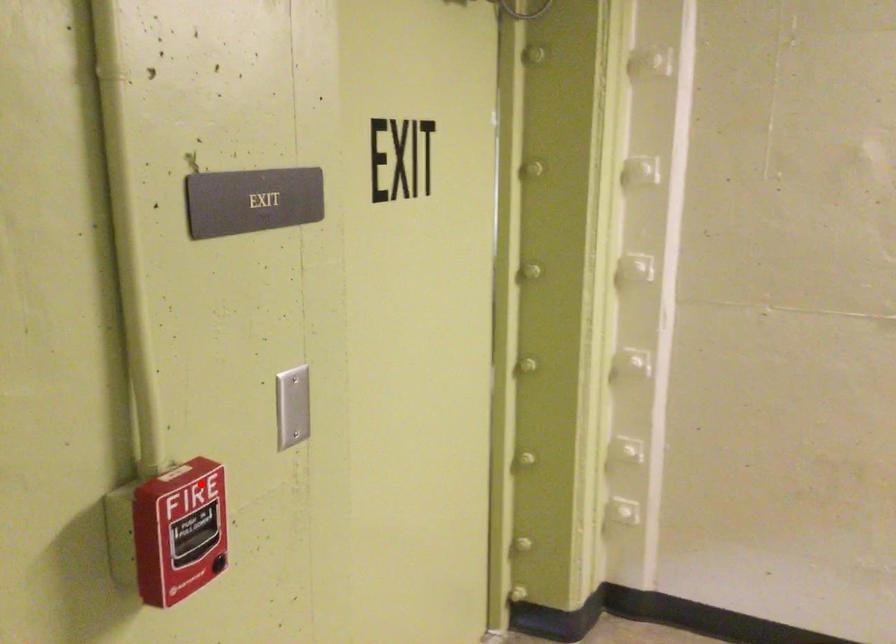
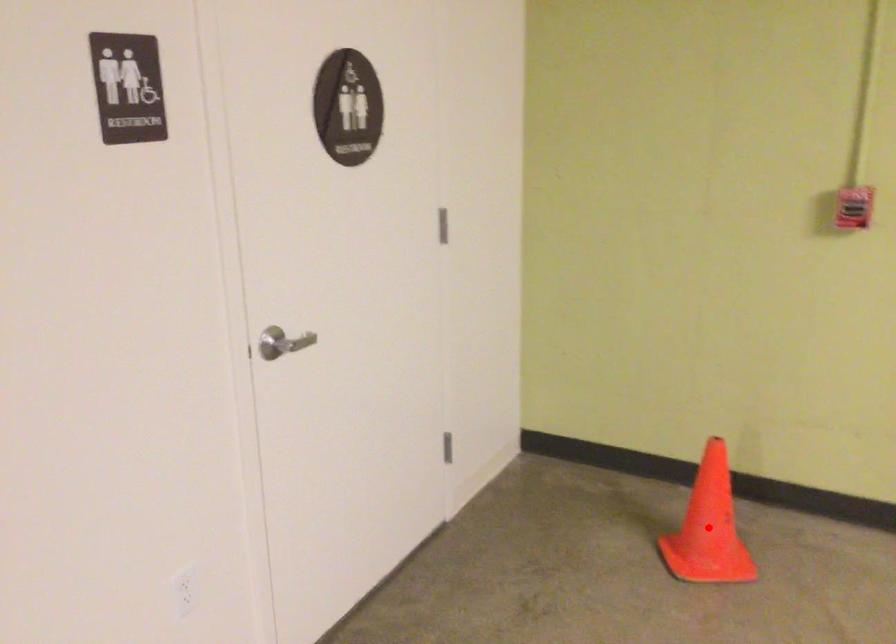
I am providing you with two images of the same scene from different viewpoints. A red point is marked on the first image and another point is marked on the second image. Does the point marked in image1 correspond to the same location as the one in image2?

No